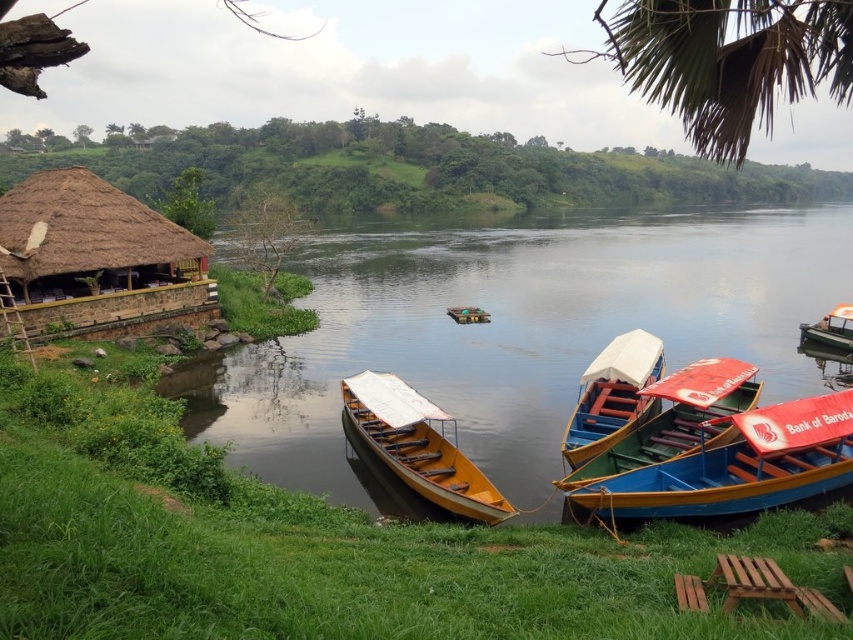
Question: From the image, what is the correct spatial relationship of blue wooden boat at lower right in relation to blue painted wood boat at center?

Choices:
 (A) above
 (B) below

Answer: (B)

Question: Is red plastic boat at lower right below green plastic boat at right?

Choices:
 (A) no
 (B) yes

Answer: (B)

Question: Can you confirm if yellow wood boat at center is wider than blue painted wood boat at center?

Choices:
 (A) yes
 (B) no

Answer: (B)

Question: Which of these objects is positioned closest to the smooth water at center?

Choices:
 (A) red plastic boat at lower right
 (B) green plastic boat at right

Answer: (B)

Question: Considering the real-world distances, which object is closest to the smooth water at center?

Choices:
 (A) red plastic boat at lower right
 (B) green plastic boat at right
 (C) blue painted wood boat at center
 (D) blue wooden boat at lower right

Answer: (C)

Question: Which point is closer to the camera?

Choices:
 (A) (77, 225)
 (B) (840, 314)
 (C) (782, 444)
 (D) (697, 371)

Answer: (C)